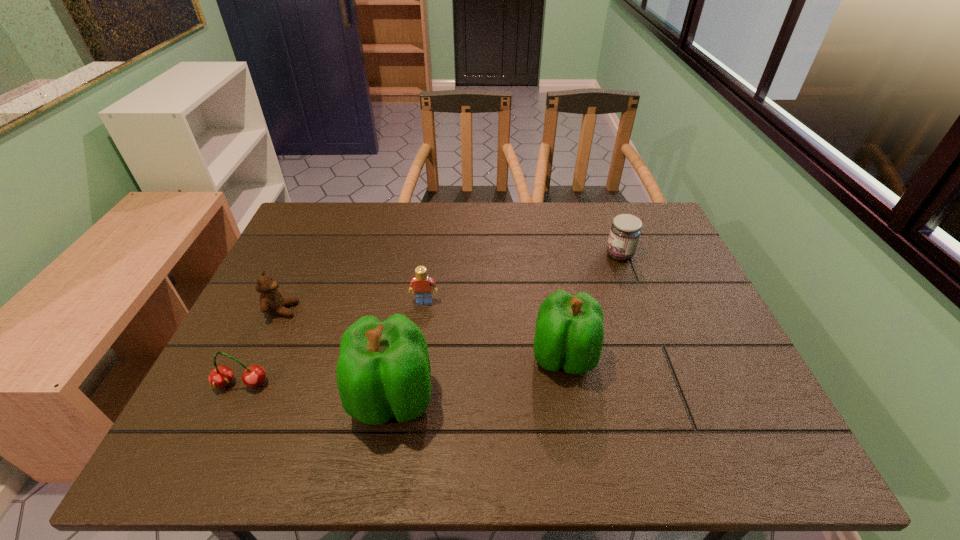
Please point a spot to add another bell pepper on the right. Please provide its 2D coordinates. Your answer should be formatted as a tuple, i.e. [(x, y)], where the tuple contains the x and y coordinates of a point satisfying the conditions above.

[(709, 321)]